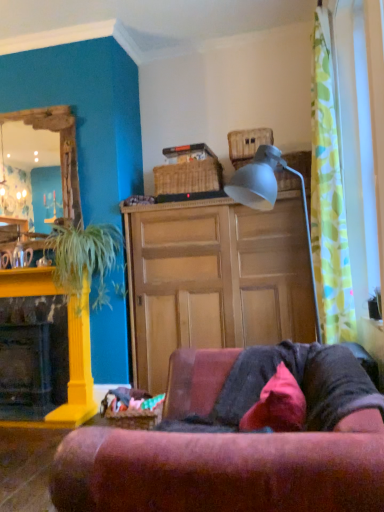
Question: Is wooden cabinet at center thinner than green floral fabric curtain at right?

Choices:
 (A) yes
 (B) no

Answer: (B)

Question: From the image's perspective, is wooden cabinet at center located beneath green floral fabric curtain at right?

Choices:
 (A) yes
 (B) no

Answer: (A)

Question: Is wooden cabinet at center located outside green floral fabric curtain at right?

Choices:
 (A) yes
 (B) no

Answer: (A)

Question: Is wooden cabinet at center aimed at green floral fabric curtain at right?

Choices:
 (A) no
 (B) yes

Answer: (B)

Question: Can you confirm if wooden cabinet at center is wider than green floral fabric curtain at right?

Choices:
 (A) yes
 (B) no

Answer: (A)

Question: Looking at their shapes, would you say wooden cabinet at center is wider or thinner than woven brown picnic basket at upper center, marked as the second picnic basket in a top-to-bottom arrangement?

Choices:
 (A) thin
 (B) wide

Answer: (B)

Question: Is wooden cabinet at center inside the boundaries of woven brown picnic basket at upper center, marked as the second picnic basket in a top-to-bottom arrangement, or outside?

Choices:
 (A) inside
 (B) outside

Answer: (B)

Question: From the image's perspective, is wooden cabinet at center located above or below woven brown picnic basket at upper center, marked as the second picnic basket in a top-to-bottom arrangement?

Choices:
 (A) below
 (B) above

Answer: (A)

Question: In the image, is wooden cabinet at center on the left side or the right side of woven brown picnic basket at upper center, the second picnic basket when ordered from bottom to top?

Choices:
 (A) right
 (B) left

Answer: (A)

Question: Considering the positions of matte white lamp at upper center and velvet pink pillow at lower center in the image, is matte white lamp at upper center wider or thinner than velvet pink pillow at lower center?

Choices:
 (A) wide
 (B) thin

Answer: (A)

Question: Relative to velvet pink pillow at lower center, is matte white lamp at upper center in front or behind?

Choices:
 (A) behind
 (B) front

Answer: (A)

Question: From their relative heights in the image, would you say matte white lamp at upper center is taller or shorter than velvet pink pillow at lower center?

Choices:
 (A) short
 (B) tall

Answer: (B)

Question: Is matte white lamp at upper center situated inside velvet pink pillow at lower center or outside?

Choices:
 (A) inside
 (B) outside

Answer: (B)

Question: Based on their positions, is green leafy plant at left located to the left or right of velvet red couch at center?

Choices:
 (A) left
 (B) right

Answer: (A)

Question: Considering the positions of green leafy plant at left and velvet red couch at center in the image, is green leafy plant at left taller or shorter than velvet red couch at center?

Choices:
 (A) short
 (B) tall

Answer: (B)